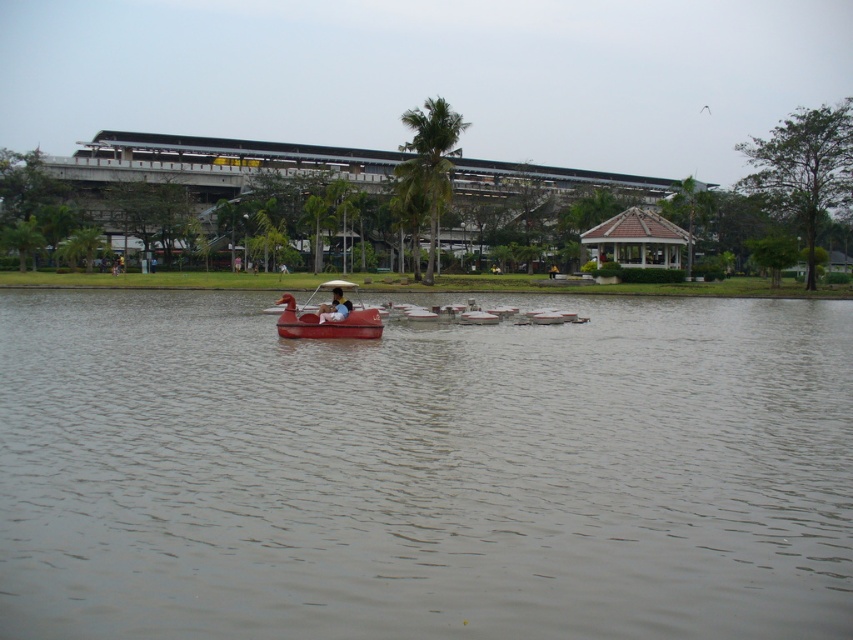
Question: Is rubber duck boat at center to the right of white plastic boat at center from the viewer's perspective?

Choices:
 (A) no
 (B) yes

Answer: (A)

Question: Can you confirm if transparent plastic water at center is thinner than white plastic boat at center?

Choices:
 (A) no
 (B) yes

Answer: (A)

Question: Is transparent plastic water at center wider than rubber duck boat at center?

Choices:
 (A) no
 (B) yes

Answer: (B)

Question: Which object is positioned farthest from the matte plastic duck boat at center?

Choices:
 (A) rubber duck boat at center
 (B) transparent plastic water at center
 (C) white plastic boat at center

Answer: (C)

Question: Which object is closer to the camera taking this photo?

Choices:
 (A) matte plastic duck boat at center
 (B) white plastic boat at center
 (C) transparent plastic water at center

Answer: (C)

Question: Which point is closer to the camera?

Choices:
 (A) matte plastic duck boat at center
 (B) white plastic boat at center

Answer: (A)